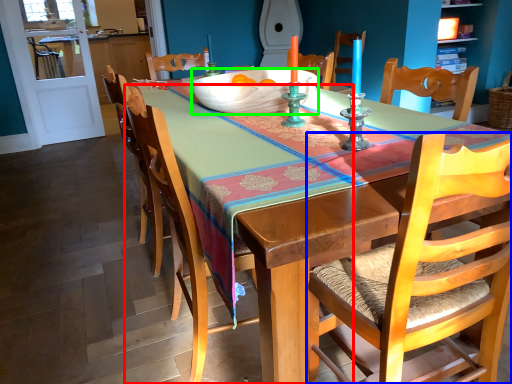
Question: Based on their relative distances, which object is farther from chair (highlighted by a red box)? Choose from chair (highlighted by a blue box) and bowl (highlighted by a green box).

Choices:
 (A) chair
 (B) bowl

Answer: (A)